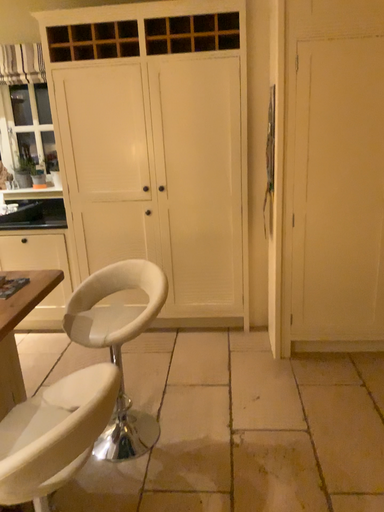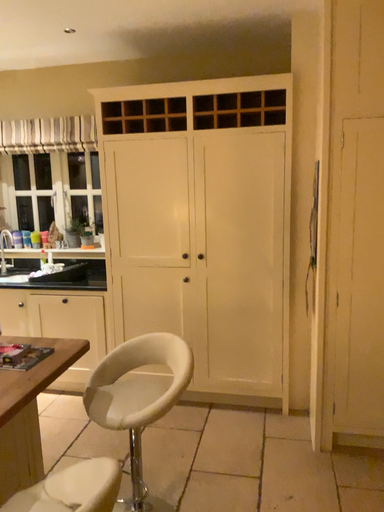
Question: How did the camera likely rotate when shooting the video?

Choices:
 (A) rotated downward
 (B) rotated upward

Answer: (B)